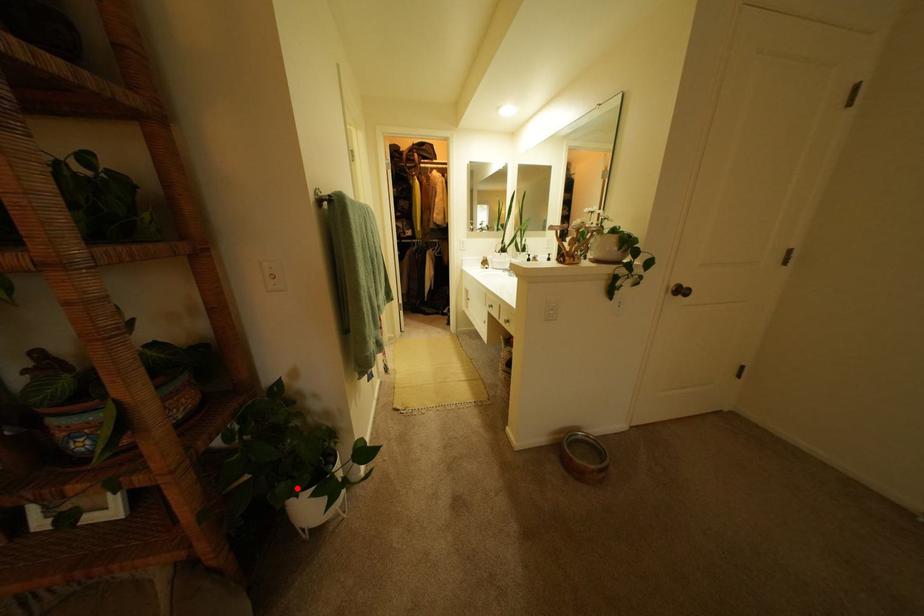
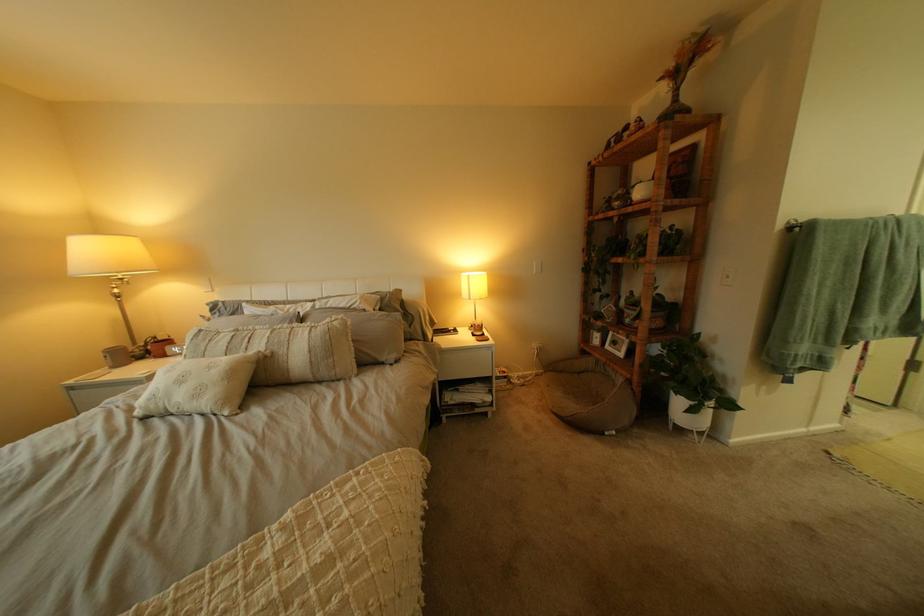
Question: I am providing you with two images of the same scene from different viewpoints. Image1 has a red point marked. In image2, the corresponding 3D location appears at what relative position? Reply with the corresponding letter.

Choices:
 (A) Closer
 (B) Farther

Answer: (B)